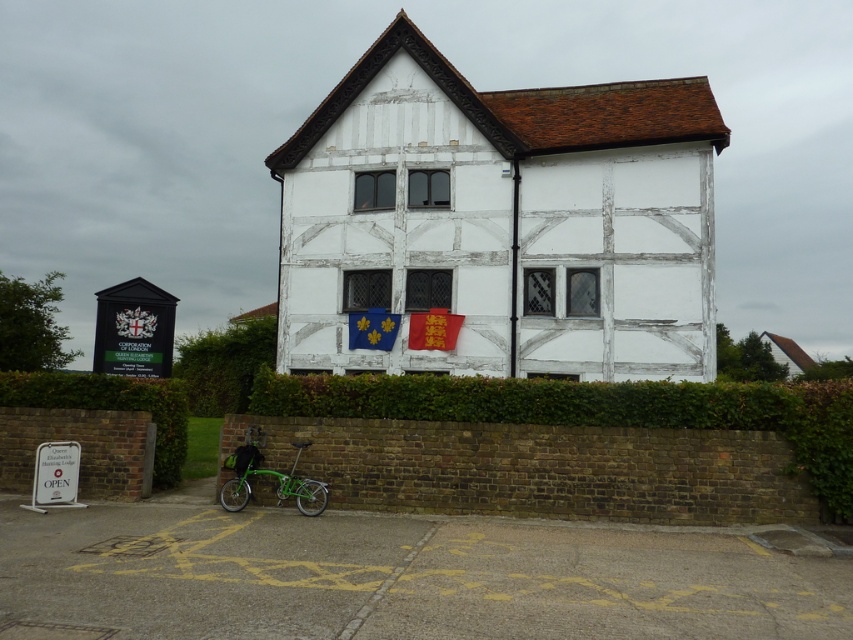
You are a gardener who needs to water the green leafy hedge at lower left and the green leafy hedge at center. If your watering can holds enough water for 10 meters of travel, how many times do you need to refill it to water both hedges starting from the building?

The distance between the green leafy hedge at lower left and the green leafy hedge at center is 33.35 meters. Since the watering can allows 10 meters of travel per refill, you would need to refill it 4 times to cover the 33.35 meters between them. However, since you start at the building, you first go to the lower left hedge, then to the center hedge, totaling 33.35 meters. Dividing 33.35 by 10 gives 3.335, so you need to refill 4 times to ensure enough water for both hedges.

You are a visitor standing in front of the traditional half timbered building. You see a green leafy hedge at lower left and a green metallic bicycle at lower left. Which object is smaller in size?

The green leafy hedge at lower left has a smaller size compared to the green metallic bicycle at lower left, so the green leafy hedge at lower left is smaller.